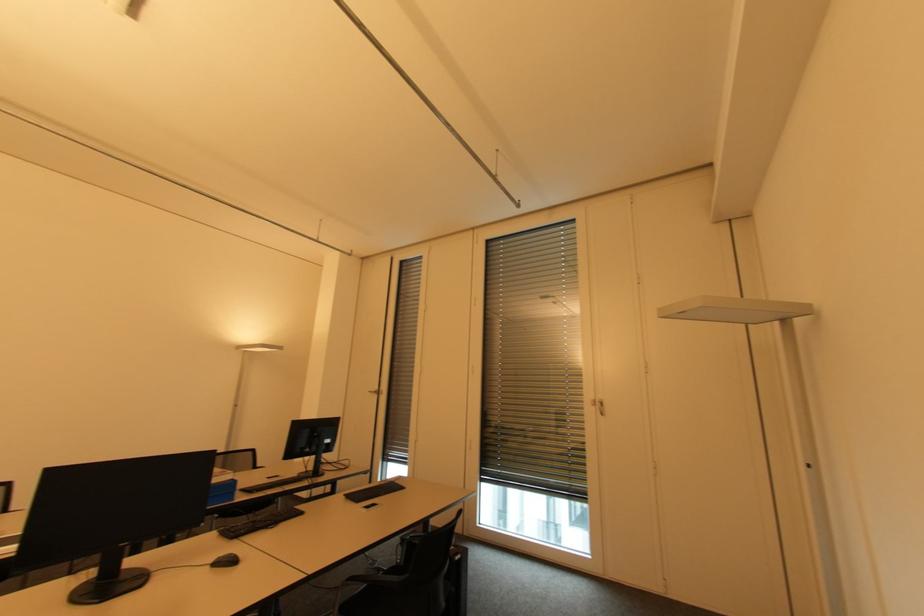
At what (x,y) coordinates should I click in order to perform the action: click on white door handle. Please return your answer as a coordinate pair (x, y). The image size is (924, 616). Looking at the image, I should click on (602, 408).